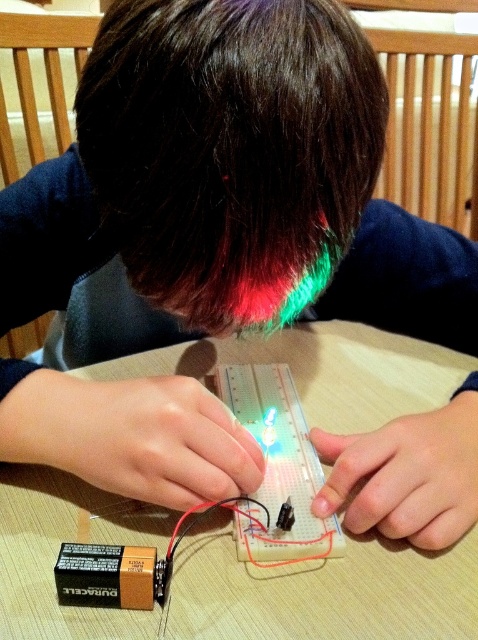
Question: Where is dark brown hair at center located in relation to beige plastic table at center in the image?

Choices:
 (A) right
 (B) left

Answer: (B)

Question: Which point is closer to the camera taking this photo?

Choices:
 (A) (271, 614)
 (B) (368, 68)

Answer: (A)

Question: From the image, what is the correct spatial relationship of dark brown hair at center in relation to beige plastic table at center?

Choices:
 (A) below
 (B) above

Answer: (B)

Question: Is dark brown hair at center to the right of beige plastic table at center from the viewer's perspective?

Choices:
 (A) yes
 (B) no

Answer: (B)